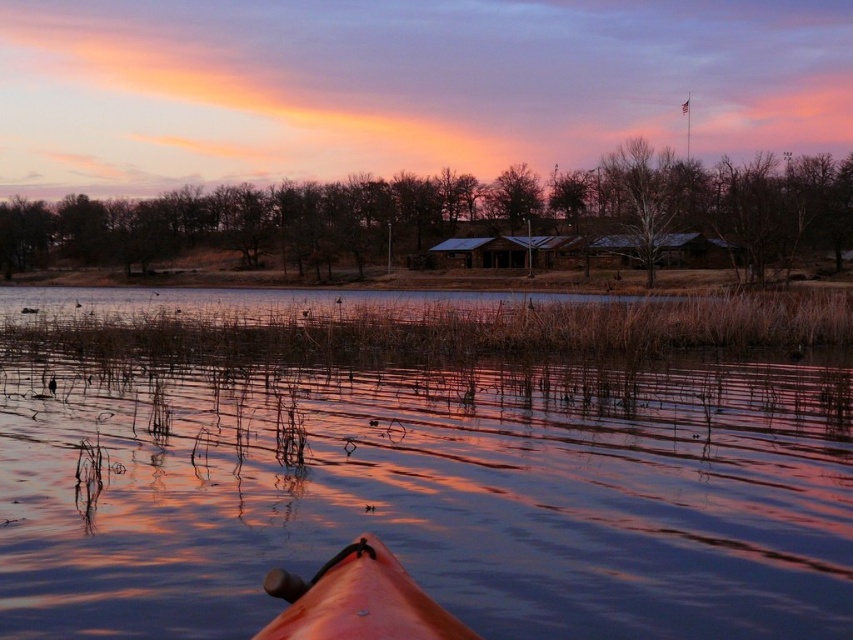
You are sitting in a kayak on a serene lake during sunrise or sunset. You notice two points in the water ahead of you. The first point is located at coordinates point (288, 522), and the second point is at point (310, 600). Which point is closer to you as you paddle forward?

Point (288, 522) is closer to you because it is further to the viewer than point (310, 600).

You are sitting in the orange matte kayak at lower center and want to paddle towards the smooth water at center. In which direction should you paddle?

The smooth water at center is to the left of the orange matte kayak at lower center, so you should paddle to the left to reach it.

You are in a kayak and want to paddle to the smooth water at center. Can you reach the smooth water at center from your current position at point (433, 493)?

Yes, because the point (433, 493) is already on the smooth water at center.